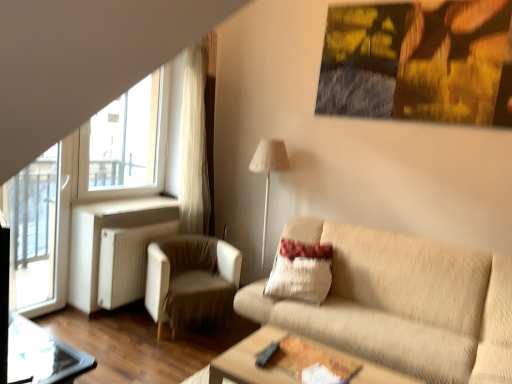
You are a GUI agent. You are given a task and a screenshot of the screen. Output one action in this format:
    pyautogui.click(x=<x>, y=<y>)
    Task: Click on the white fabric armchair at left
    The width and height of the screenshot is (512, 384).
    Given the screenshot: What is the action you would take?
    pyautogui.click(x=191, y=280)

Describe the element at coordinates (301, 272) in the screenshot. I see `beige textured pillow at center` at that location.

Locate an element on the screen. This screenshot has width=512, height=384. beige textured pillow at center is located at coordinates (301, 272).

Measure the distance between point (234, 354) and camera.

Point (234, 354) is 2.21 meters from camera.

Where is `transparent glass table at lower left`? This screenshot has width=512, height=384. transparent glass table at lower left is located at coordinates (42, 354).

Describe the element at coordinates (402, 304) in the screenshot. The height and width of the screenshot is (384, 512). I see `beige fabric couch at center` at that location.

Find the location of a particular element. The height and width of the screenshot is (384, 512). white fabric lampshade at center is located at coordinates (268, 173).

How many degrees apart are the facing directions of beige textured pillow at center and wooden table at lower center?

There is a 91.3-degree angle between the facing directions of beige textured pillow at center and wooden table at lower center.

Are beige textured pillow at center and wooden table at lower center located far from each other?

No, beige textured pillow at center is not far from wooden table at lower center.

Considering the relative sizes of beige textured pillow at center and wooden table at lower center in the image provided, is beige textured pillow at center shorter than wooden table at lower center?

Incorrect, the height of beige textured pillow at center does not fall short of that of wooden table at lower center.

Is beige textured pillow at center wider than wooden table at lower center?

Incorrect, the width of beige textured pillow at center does not surpass that of wooden table at lower center.

Between white fabric armchair at left and wooden table at lower center, which one appears on the left side from the viewer's perspective?

From the viewer's perspective, white fabric armchair at left appears more on the left side.

Which is behind, white fabric armchair at left or wooden table at lower center?

white fabric armchair at left is behind.

Is white fabric armchair at left facing away from wooden table at lower center?

No, wooden table at lower center is not at the back of white fabric armchair at left.

Considering the sizes of objects white fabric armchair at left and beige fabric couch at center in the image provided, who is wider, white fabric armchair at left or beige fabric couch at center?

beige fabric couch at center.

Is point (166, 250) more distant than point (433, 268)?

Yes, it is.

Is white fabric armchair at left in contact with beige fabric couch at center?

No, white fabric armchair at left is not making contact with beige fabric couch at center.

Visually, is white fabric lampshade at center positioned to the left or to the right of transparent glass screen door at left?

From the image, it's evident that white fabric lampshade at center is to the right of transparent glass screen door at left.

Which point is more distant from viewer, (286,153) or (34,254)?

Point (34,254)

Considering the sizes of white fabric lampshade at center and transparent glass screen door at left in the image, is white fabric lampshade at center wider or thinner than transparent glass screen door at left?

white fabric lampshade at center is wider than transparent glass screen door at left.

Is white fabric lampshade at center in contact with transparent glass screen door at left?

No, white fabric lampshade at center is not with transparent glass screen door at left.

Is beige fabric couch at center to the left of wooden table at lower center from the viewer's perspective?

In fact, beige fabric couch at center is to the right of wooden table at lower center.

Does beige fabric couch at center have a lesser height compared to wooden table at lower center?

In fact, beige fabric couch at center may be taller than wooden table at lower center.

Would you say beige fabric couch at center is inside or outside wooden table at lower center?

beige fabric couch at center exists outside the volume of wooden table at lower center.

What are the coordinates of `studio couch located behind the wooden table at lower center` in the screenshot? It's located at (402, 304).

Is beige fabric couch at center wider or thinner than beige textured pillow at center?

Considering their sizes, beige fabric couch at center looks broader than beige textured pillow at center.

Identify the location of studio couch in front of the beige textured pillow at center. 402,304.

How different are the orientations of beige fabric couch at center and beige textured pillow at center in degrees?

beige fabric couch at center and beige textured pillow at center are facing 0.904 degrees away from each other.

From a real-world perspective, is beige fabric couch at center positioned over transparent glass table at lower left based on gravity?

Correct, in the physical world, beige fabric couch at center is higher than transparent glass table at lower left.

In terms of height, does beige fabric couch at center look taller or shorter compared to transparent glass table at lower left?

Considering their sizes, beige fabric couch at center has more height than transparent glass table at lower left.

Identify the location of studio couch above the transparent glass table at lower left (from a real-world perspective). (402, 304).

Does beige fabric couch at center have a lesser width compared to transparent glass table at lower left?

In fact, beige fabric couch at center might be wider than transparent glass table at lower left.

This screenshot has width=512, height=384. In order to click on pillow behind the wooden table at lower center in this screenshot , I will do `click(301, 272)`.

Locate an element on the screen. chair lying above the wooden table at lower center (from the image's perspective) is located at coordinates (191, 280).

Looking at the image, which one is located further to beige fabric couch at center, transparent glass table at lower left or transparent glass screen door at left?

transparent glass screen door at left is further to beige fabric couch at center.

Which object lies nearer to the anchor point wooden table at lower center, beige textured pillow at center or transparent glass screen door at left?

Based on the image, beige textured pillow at center appears to be nearer to wooden table at lower center.

Which object lies nearer to the anchor point transparent glass table at lower left, transparent glass screen door at left or white fabric armchair at left?

white fabric armchair at left lies closer to transparent glass table at lower left than the other object.

From the image, which object appears to be nearer to beige fabric couch at center, transparent glass screen door at left or wooden table at lower center?

wooden table at lower center lies closer to beige fabric couch at center than the other object.

When comparing their distances from transparent glass screen door at left, does transparent glass table at lower left or beige fabric couch at center seem further?

beige fabric couch at center.

Estimate the real-world distances between objects in this image. Which object is closer to wooden table at lower center, transparent glass table at lower left or white fabric lampshade at center?

Among the two, transparent glass table at lower left is located nearer to wooden table at lower center.

From the image, which object appears to be farther from wooden table at lower center, beige fabric couch at center or transparent glass table at lower left?

transparent glass table at lower left.

From the image, which object appears to be nearer to beige fabric couch at center, transparent glass screen door at left or transparent glass table at lower left?

transparent glass table at lower left is closer to beige fabric couch at center.

Image resolution: width=512 pixels, height=384 pixels. I want to click on pillow between transparent glass table at lower left and beige fabric couch at center from left to right, so pos(301,272).

You are a GUI agent. You are given a task and a screenshot of the screen. Output one action in this format:
    pyautogui.click(x=<x>, y=<y>)
    Task: Click on the table situated between transparent glass screen door at left and beige textured pillow at center from left to right
    This screenshot has height=384, width=512.
    Given the screenshot: What is the action you would take?
    pyautogui.click(x=284, y=371)

In order to click on chair between transparent glass screen door at left and wooden table at lower center from left to right in this screenshot , I will do `click(191, 280)`.

This screenshot has height=384, width=512. Find the location of `table lamp between transparent glass table at lower left and beige fabric couch at center`. table lamp between transparent glass table at lower left and beige fabric couch at center is located at coordinates (268, 173).